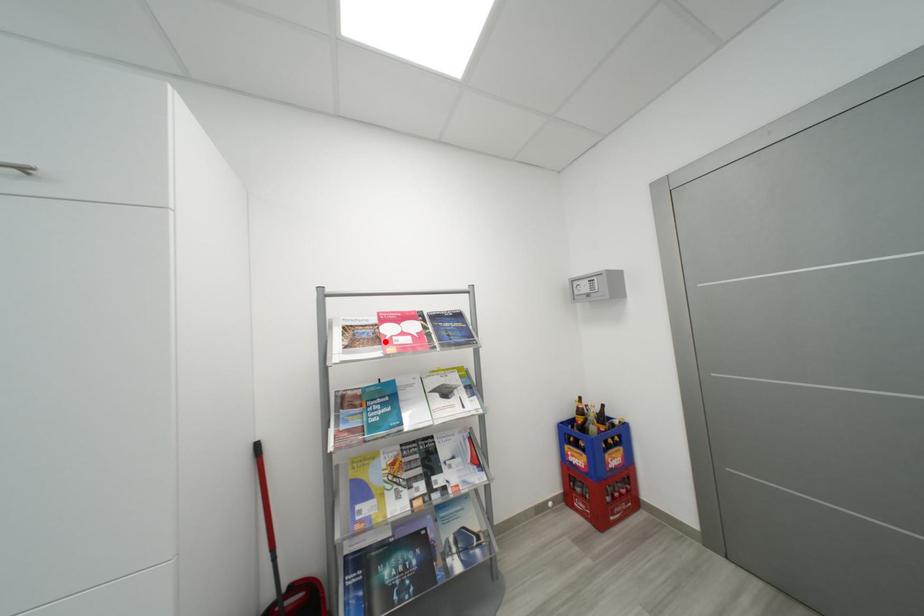
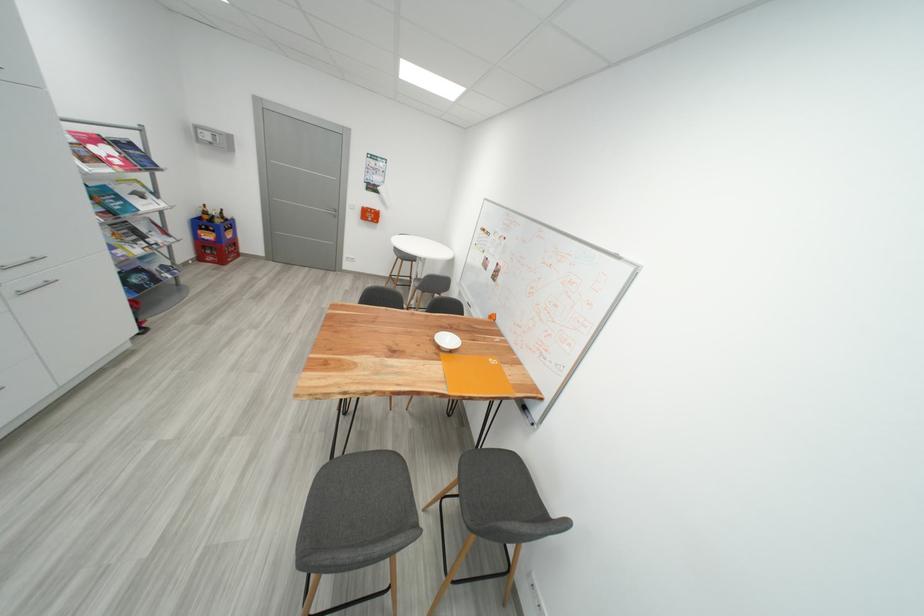
Locate, in the second image, the point that corresponds to the highlighted location in the first image.

(104, 161)